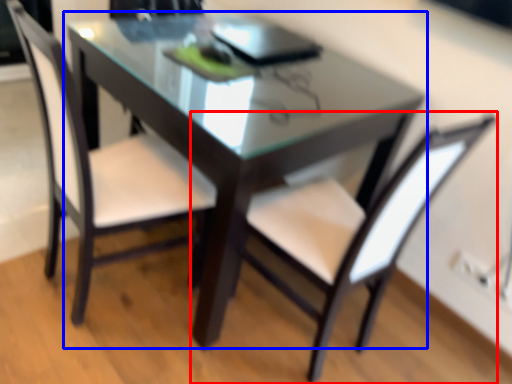
Question: Which object is further to the camera taking this photo, chair (highlighted by a red box) or table (highlighted by a blue box)?

Choices:
 (A) chair
 (B) table

Answer: (B)